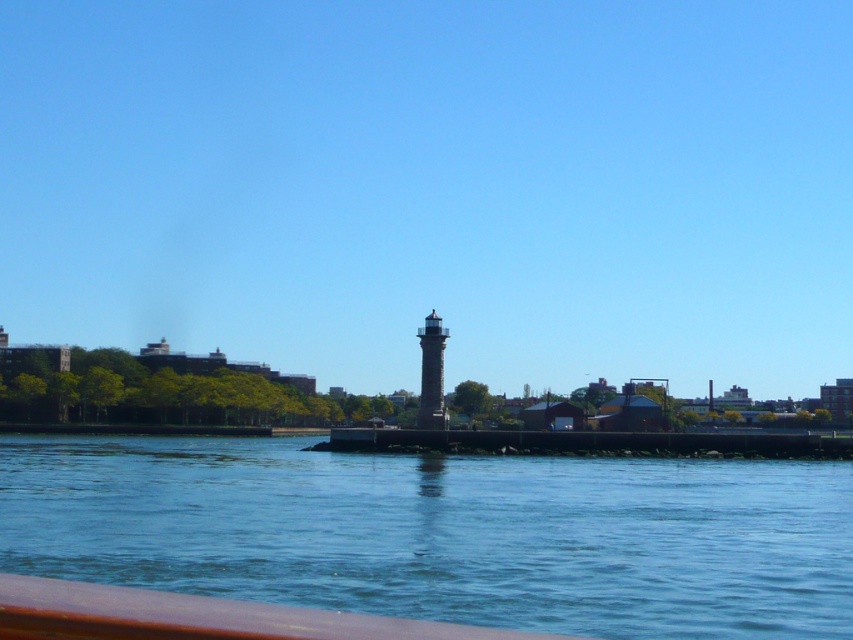
Question: Does blue water at center appear on the right side of gray stone lighthouse at center?

Choices:
 (A) yes
 (B) no

Answer: (B)

Question: Can you confirm if blue water at center is smaller than gray stone lighthouse at center?

Choices:
 (A) no
 (B) yes

Answer: (A)

Question: Which object appears farthest from the camera in this image?

Choices:
 (A) blue water at center
 (B) gray stone lighthouse at center

Answer: (B)

Question: Which object is farther from the camera taking this photo?

Choices:
 (A) blue water at center
 (B) gray stone lighthouse at center

Answer: (B)

Question: Is blue water at center wider than gray stone lighthouse at center?

Choices:
 (A) yes
 (B) no

Answer: (A)

Question: Among these points, which one is nearest to the camera?

Choices:
 (A) (772, 608)
 (B) (438, 392)

Answer: (A)